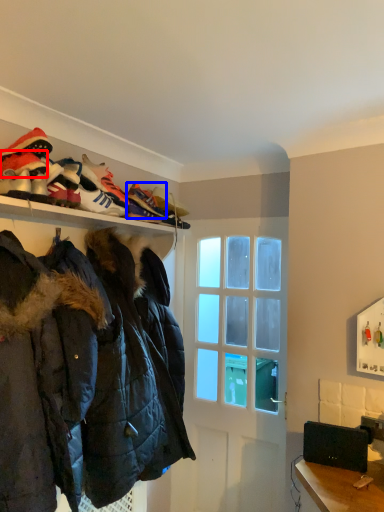
Question: Which point is further to the camera, footwear (highlighted by a red box) or shoe (highlighted by a blue box)?

Choices:
 (A) footwear
 (B) shoe

Answer: (B)